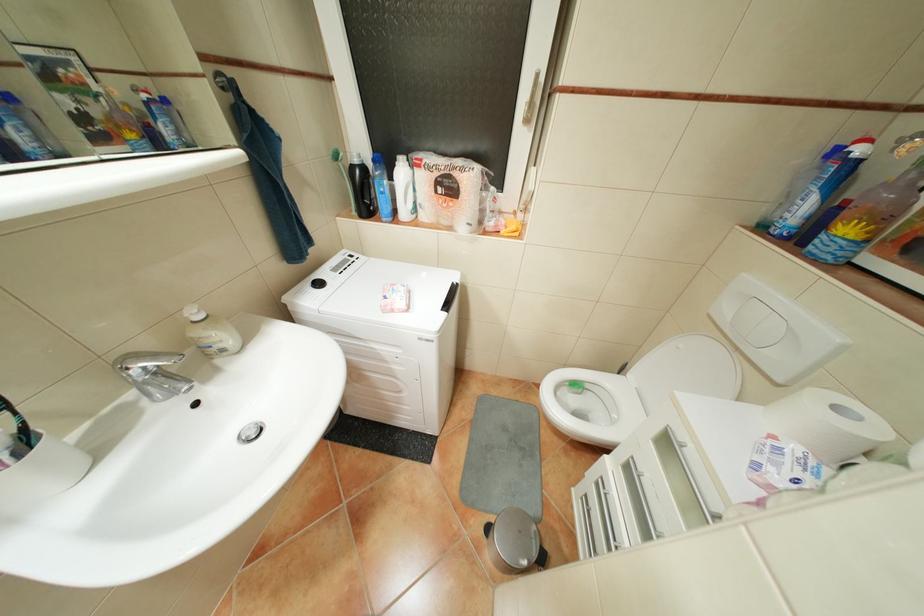
Describe the element at coordinates (314, 286) in the screenshot. The image size is (924, 616). I see `a washing machine dial` at that location.